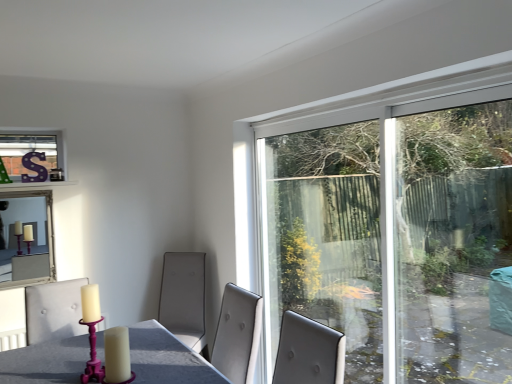
Question: From a real-world perspective, relative to transparent glass window at upper right, is silver-framed mirror at upper left vertically above or below?

Choices:
 (A) above
 (B) below

Answer: (B)

Question: Which is correct: silver-framed mirror at upper left is inside transparent glass window at upper right, or outside of it?

Choices:
 (A) outside
 (B) inside

Answer: (A)

Question: In the image, is silver-framed mirror at upper left positioned in front of or behind transparent glass window at upper right?

Choices:
 (A) front
 (B) behind

Answer: (B)

Question: Is transparent glass window at upper right inside or outside of silver-framed mirror at upper left?

Choices:
 (A) inside
 (B) outside

Answer: (B)

Question: Does point (392, 340) appear closer or farther from the camera than point (9, 281)?

Choices:
 (A) farther
 (B) closer

Answer: (B)

Question: From a real-world perspective, is transparent glass window at upper right positioned above or below silver-framed mirror at upper left?

Choices:
 (A) above
 (B) below

Answer: (A)

Question: Looking at their shapes, would you say transparent glass window at upper right is wider or thinner than silver-framed mirror at upper left?

Choices:
 (A) wide
 (B) thin

Answer: (B)